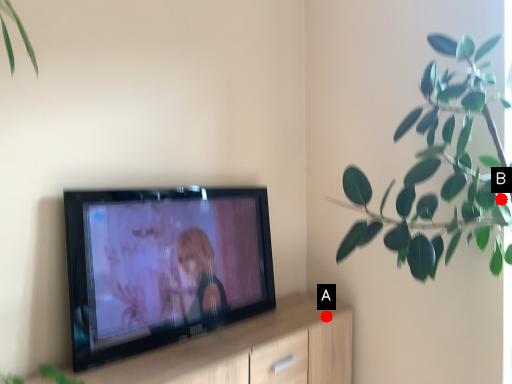
Question: Two points are circled on the image, labeled by A and B beside each circle. Which point is farther to the camera?

Choices:
 (A) A is further
 (B) B is further

Answer: (A)